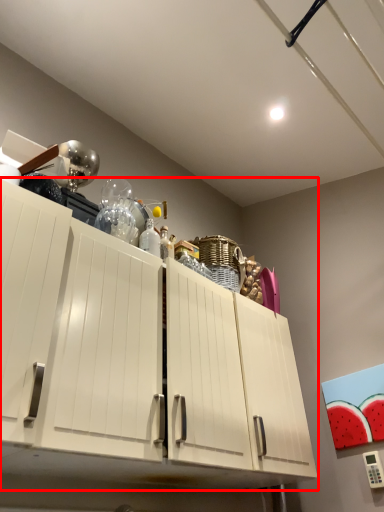
Question: In this image, where is cabinetry (annotated by the red box) located relative to bottle?

Choices:
 (A) right
 (B) left

Answer: (A)